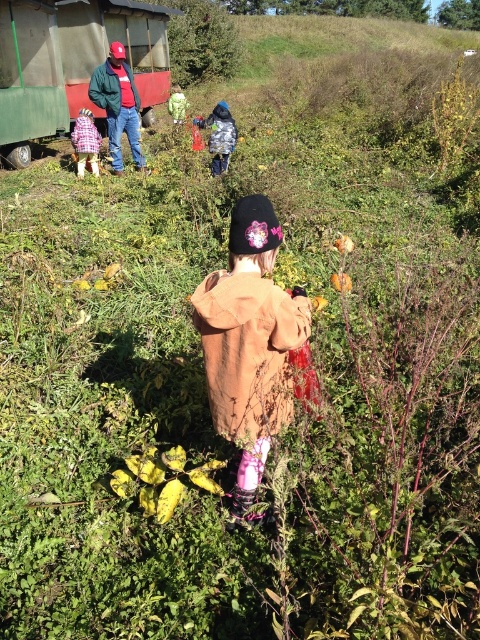
Question: Which object is positioned farthest from the fuzzy brown coat at center?

Choices:
 (A) plaid fabric coat at center
 (B) reddish-brown leather jacket at upper left
 (C) green fabric bag at center
 (D) shiny metallic jacket at center

Answer: (C)

Question: Is fuzzy brown coat at center smaller than green weathered train car at upper left?

Choices:
 (A) yes
 (B) no

Answer: (A)

Question: Which is farther from the green weathered train car at upper left?

Choices:
 (A) reddish-brown leather jacket at upper left
 (B) plaid fabric coat at center
 (C) shiny metallic jacket at center

Answer: (C)

Question: From the image, what is the correct spatial relationship of fuzzy brown coat at center in relation to plaid fabric coat at center?

Choices:
 (A) below
 (B) above

Answer: (A)

Question: Which point is closer to the camera?

Choices:
 (A) (238, 227)
 (B) (72, 132)
 (C) (213, 109)

Answer: (A)

Question: Is reddish-brown leather jacket at upper left to the right of green fabric bag at center from the viewer's perspective?

Choices:
 (A) yes
 (B) no

Answer: (B)